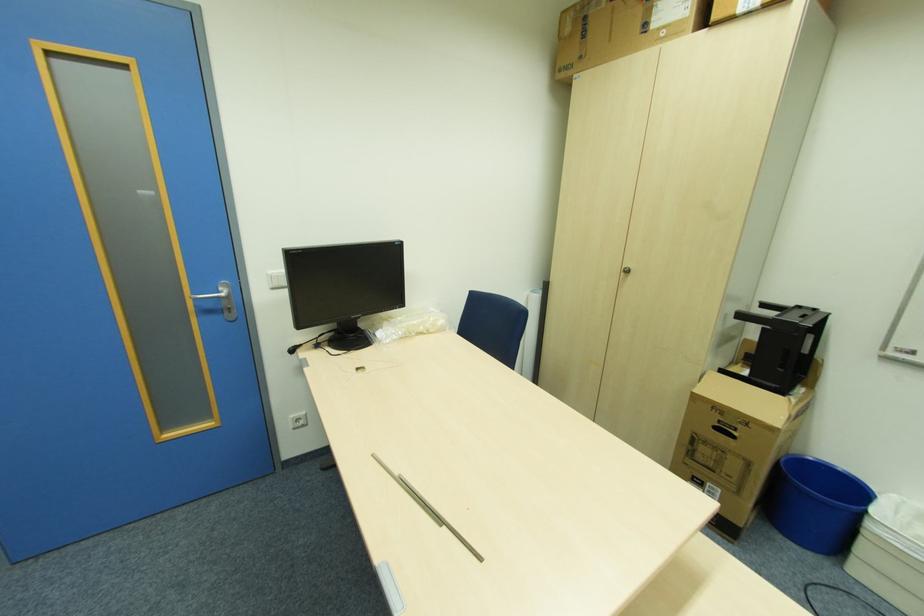
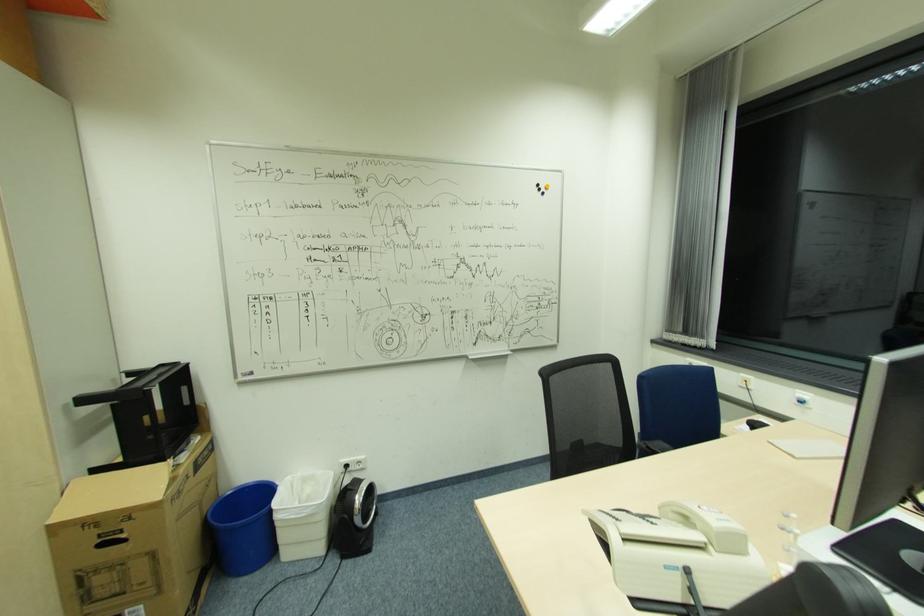
Find the pixel in the second image that matches the point at 896,496 in the first image.

(290, 477)